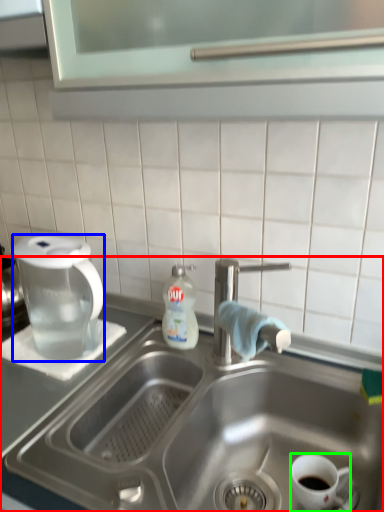
Question: Which object is positioned closest to sink (highlighted by a red box)? Select from coffee maker (highlighted by a blue box) and coffee cup (highlighted by a green box).

Choices:
 (A) coffee maker
 (B) coffee cup

Answer: (B)